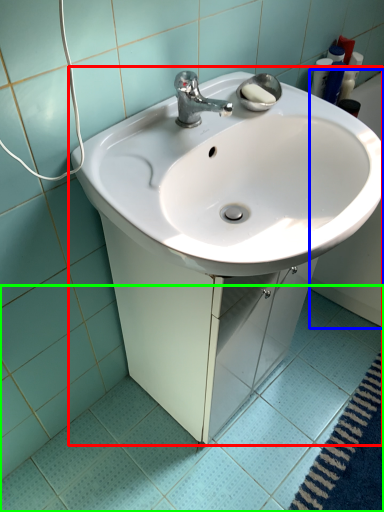
Question: Which is nearer to the sink (highlighted by a red box)? bath (highlighted by a blue box) or ceramic tile (highlighted by a green box).

Choices:
 (A) bath
 (B) ceramic tile

Answer: (B)